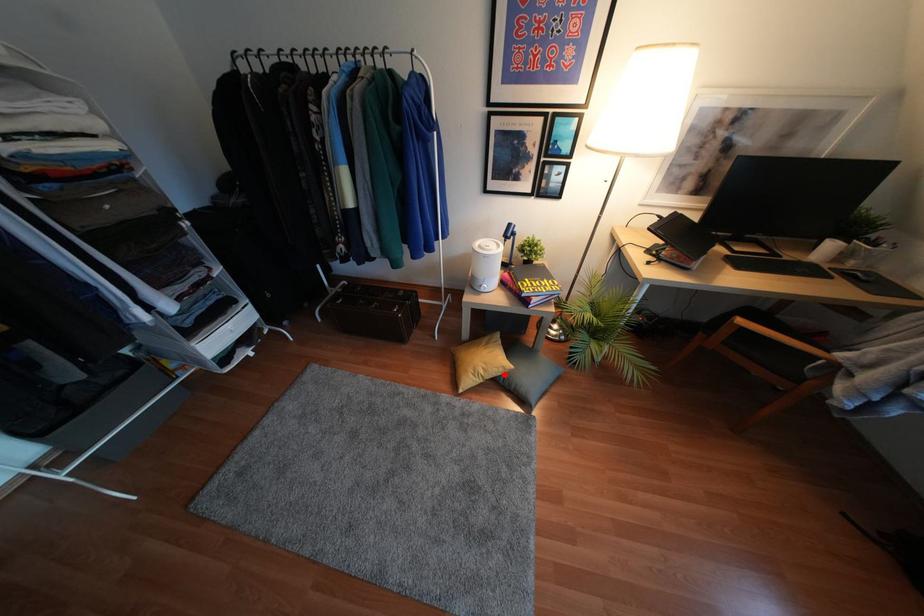
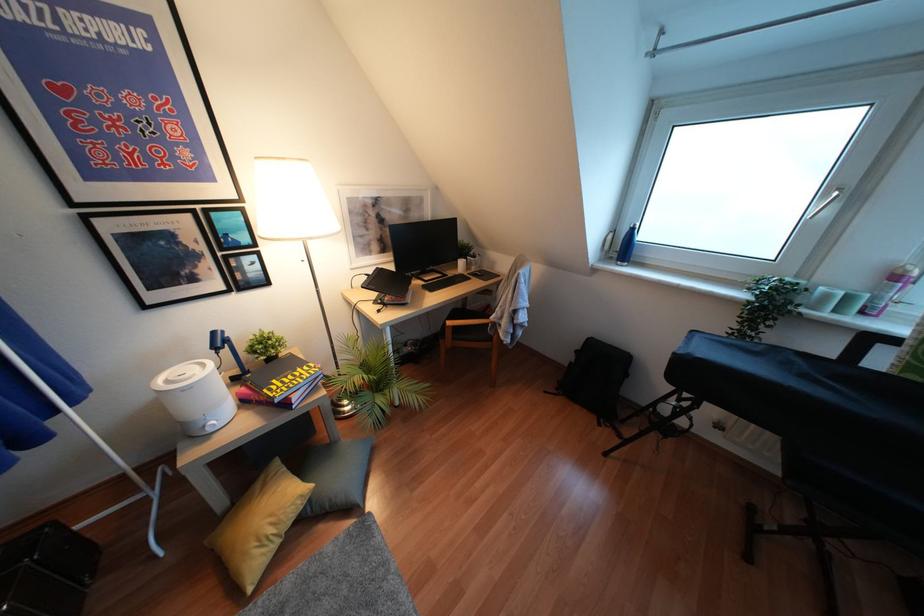
Question: I am providing you with two images of the same scene from different viewpoints. In image1, a red point is highlighted. Considering the same 3D point in image2, which of the following is correct?

Choices:
 (A) It is closer
 (B) It is farther

Answer: (B)